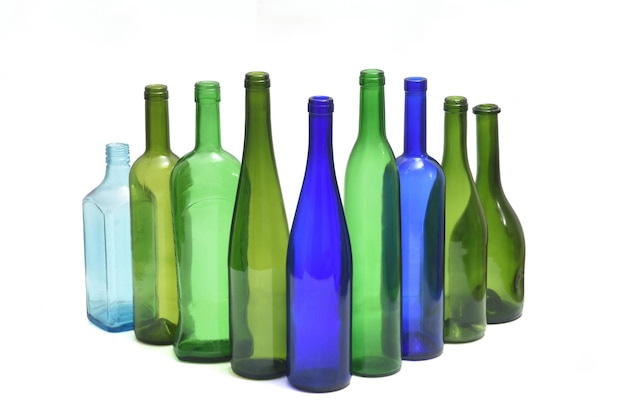
The image size is (626, 417). Find the location of `green glass bottles`. green glass bottles is located at coordinates (146, 261), (207, 266), (252, 278), (372, 283), (464, 268), (501, 258).